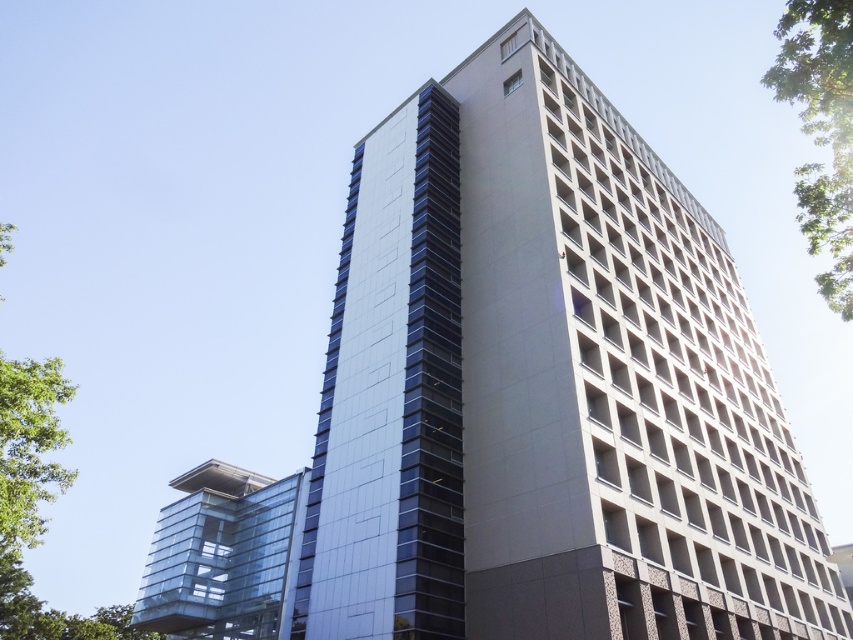
Question: Which point is farther to the camera?

Choices:
 (A) transparent glass tower at lower left
 (B) glossy glass tower at center

Answer: (A)

Question: Can you confirm if glossy glass tower at center is positioned above transparent glass tower at lower left?

Choices:
 (A) yes
 (B) no

Answer: (A)

Question: Does glossy glass tower at center come in front of transparent glass tower at lower left?

Choices:
 (A) no
 (B) yes

Answer: (B)

Question: Among these points, which one is nearest to the camera?

Choices:
 (A) (177, 513)
 (B) (654, 257)

Answer: (B)

Question: Does glossy glass tower at center appear on the right side of transparent glass tower at lower left?

Choices:
 (A) yes
 (B) no

Answer: (A)

Question: Among these points, which one is nearest to the camera?

Choices:
 (A) (271, 540)
 (B) (399, 216)

Answer: (B)